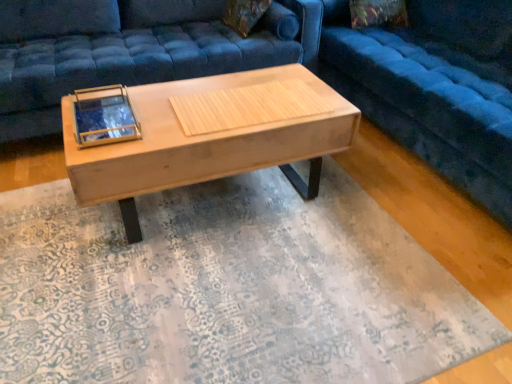
Question: Considering the relative positions of velvet blue studio couch at center, which is the 2th studio couch in left-to-right order, and velvet blue studio couch at center, arranged as the first studio couch when viewed from the left, in the image provided, is velvet blue studio couch at center, which is the 2th studio couch in left-to-right order, to the left or to the right of velvet blue studio couch at center, arranged as the first studio couch when viewed from the left,?

Choices:
 (A) right
 (B) left

Answer: (A)

Question: From the image's perspective, is velvet blue studio couch at center, which is the 2th studio couch in left-to-right order, positioned above or below velvet blue studio couch at center, the second studio couch viewed from the right?

Choices:
 (A) above
 (B) below

Answer: (B)

Question: Which object is positioned closest to the velvet blue studio couch at center, which is the 2th studio couch in left-to-right order?

Choices:
 (A) velvet blue studio couch at center, arranged as the first studio couch when viewed from the left
 (B) natural wood coffee table at center

Answer: (B)

Question: Which is nearer to the velvet blue studio couch at center, arranged as the first studio couch when viewed from the left?

Choices:
 (A) velvet blue studio couch at center, which is the 2th studio couch in left-to-right order
 (B) natural wood coffee table at center

Answer: (B)